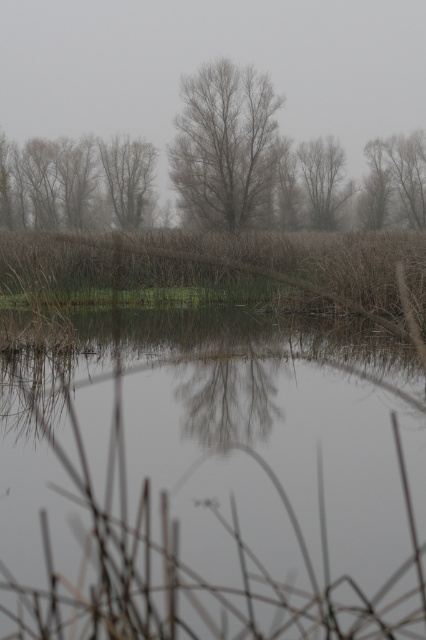
Is gray-brown bark tree at center wider than bare branches at center?

Indeed, gray-brown bark tree at center has a greater width compared to bare branches at center.

Which is behind, point (258, 170) or point (123, 145)?

The point (123, 145) is more distant.

Find the location of a particular element. The width and height of the screenshot is (426, 640). gray-brown bark tree at center is located at coordinates (227, 147).

Find the location of a particular element. The image size is (426, 640). gray-brown bark tree at center is located at coordinates (227, 147).

Does brown textured tree at upper right have a larger size compared to smooth bark tree at center?

Indeed, brown textured tree at upper right has a larger size compared to smooth bark tree at center.

Which is more to the left, brown textured tree at upper right or smooth bark tree at center?

Positioned to the left is smooth bark tree at center.

Between point (408, 180) and point (325, 195), which one is positioned in front?

Point (325, 195) is more forward.

The width and height of the screenshot is (426, 640). What are the coordinates of `brown textured tree at upper right` in the screenshot? It's located at point(394,182).

Between gray-brown bark tree at center and brown textured trees at left, which one has more height?

Standing taller between the two is gray-brown bark tree at center.

Between point (279, 141) and point (74, 205), which one is positioned behind?

The point (74, 205) is more distant.

Is point (264, 124) farther from viewer compared to point (118, 182)?

That is False.

I want to click on gray-brown bark tree at center, so click(227, 147).